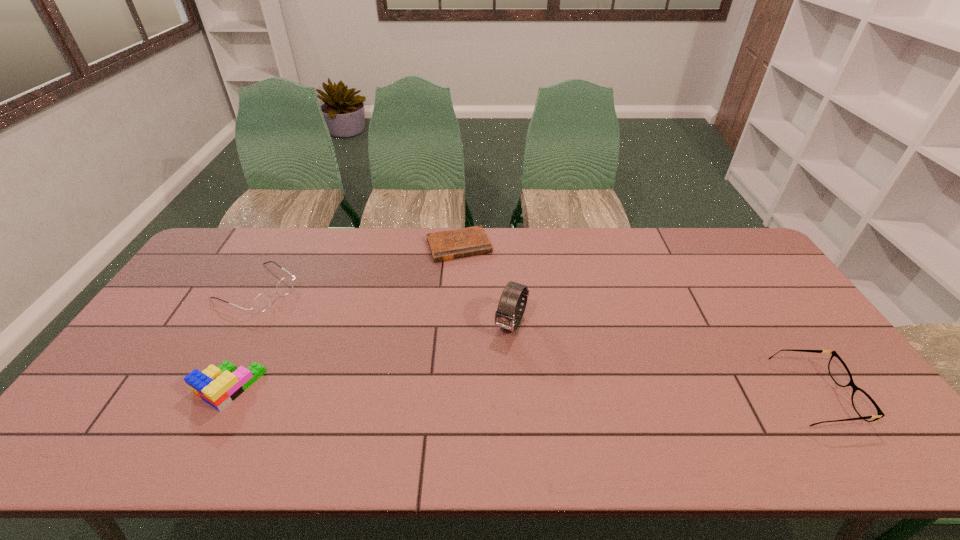
Identify the location of Lego. (218, 386).

The height and width of the screenshot is (540, 960). What are the coordinates of `the nearer spectacles` in the screenshot? It's located at (864, 405).

Locate an element on the screen. This screenshot has width=960, height=540. the right spectacles is located at coordinates (864, 405).

Identify the location of the left spectacles. The width and height of the screenshot is (960, 540). (262, 301).

You are a GUI agent. You are given a task and a screenshot of the screen. Output one action in this format:
    pyautogui.click(x=<x>, y=<y>)
    Task: Click on the watch
    The image size is (960, 540).
    Given the screenshot: What is the action you would take?
    pyautogui.click(x=510, y=303)

You are a GUI agent. You are given a task and a screenshot of the screen. Output one action in this format:
    pyautogui.click(x=<x>, y=<y>)
    Task: Click on the shortest object
    The image size is (960, 540).
    Given the screenshot: What is the action you would take?
    pyautogui.click(x=446, y=245)

Identify the location of diary. (446, 245).

Locate an element on the screen. free space located 0.150m on the right of the Lego is located at coordinates (319, 387).

Locate an element on the screen. The image size is (960, 540). free spot located 0.140m through the lenses of the left spectacles is located at coordinates pos(316,322).

You are a GUI agent. You are given a task and a screenshot of the screen. Output one action in this format:
    pyautogui.click(x=<x>, y=<y>)
    Task: Click on the free space located 0.070m through the lenses of the left spectacles
    The image size is (960, 540).
    Given the screenshot: What is the action you would take?
    pyautogui.click(x=300, y=313)